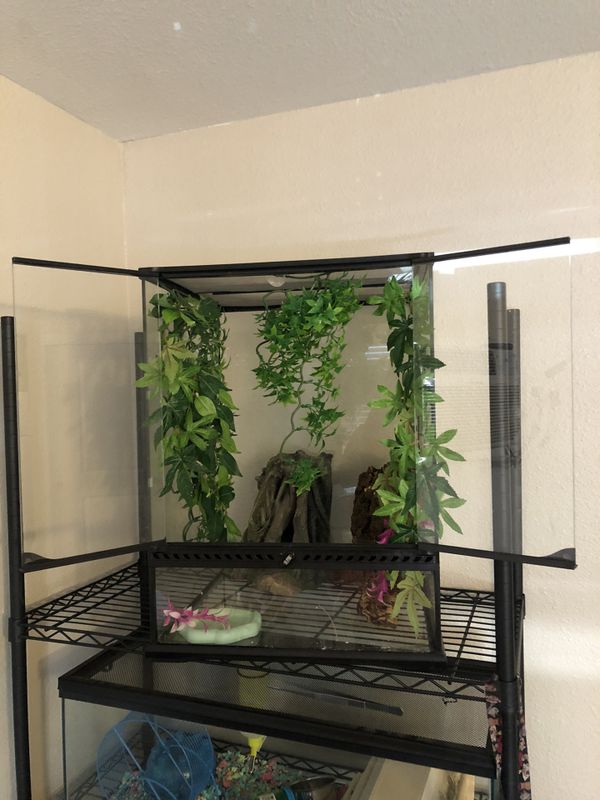
Where is `bedding`? bedding is located at coordinates (230, 770).